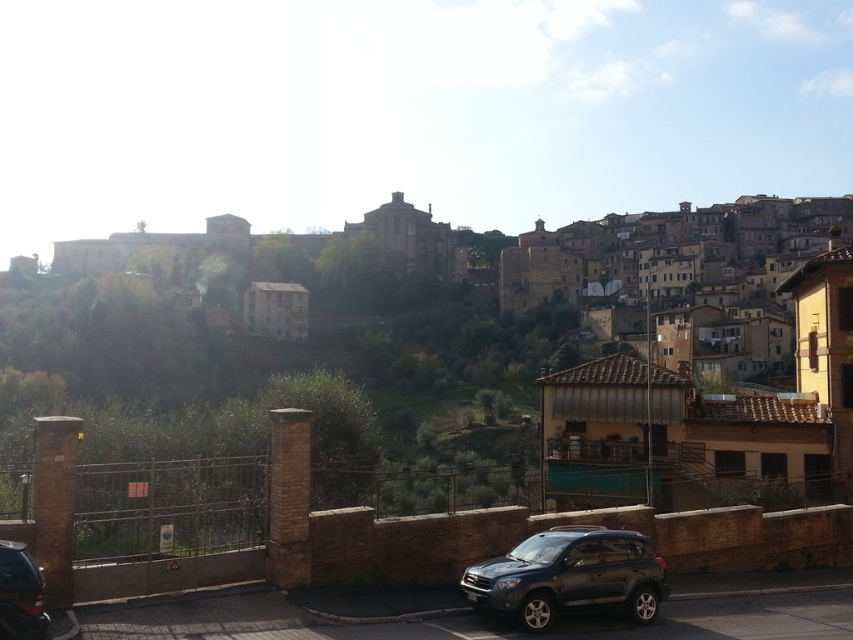
You are a tour guide leading a group through the town. You need to point out both the satin dark gray suv at lower center and the shiny black car at lower left. Which one is closer to the group?

The satin dark gray suv at lower center is closer to the group because it is further to the viewer than the shiny black car at lower left.

You are a delivery driver needing to park your vehicle between the two cars on the road. Your vehicle is 2 meters wide. Which car should you position your vehicle next to, the satin dark gray suv at lower center or the shiny black car at lower left, to ensure enough space?

The satin dark gray suv at lower center is wider than the shiny black car at lower left. Therefore, positioning your vehicle next to the shiny black car at lower left would provide more space since it is narrower.